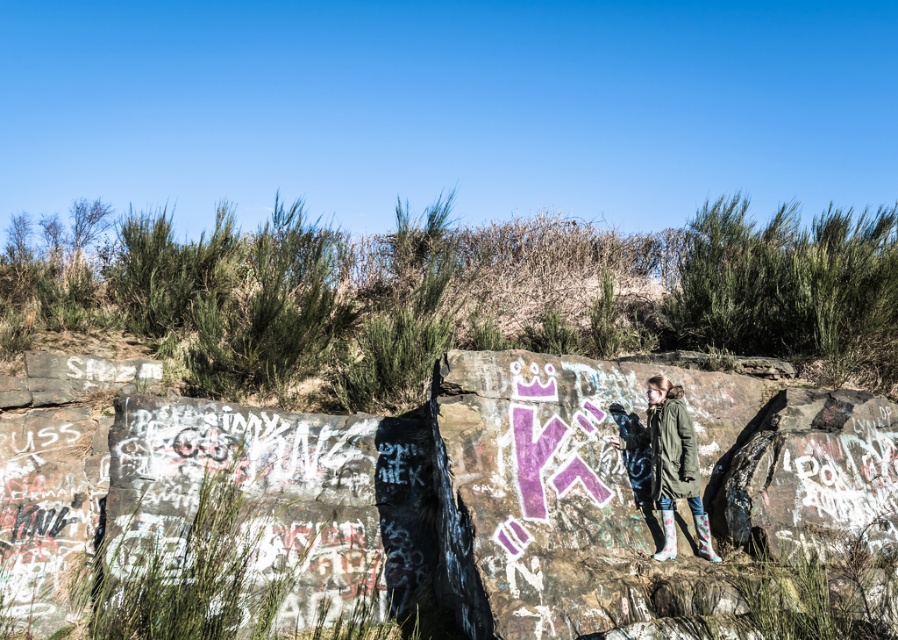
You are a photographer trying to capture the graffiti on the rocks. You notice two points marked on your map at coordinates point [207,422] and point [383,348]. Which point should you stand closer to in order to get a better view of the graffiti details?

You should stand closer to point [207,422] because it is closer to the viewer than point [383,348], allowing for a better view of the graffiti details.

You are a photographer wanting to capture the green matte jacket at center and the green grass at center in your shot. Since both are green, how can you distinguish them in the photo?

The green grass at center is located to the left of the green matte jacket at center, so you can differentiate them by their position in the frame.